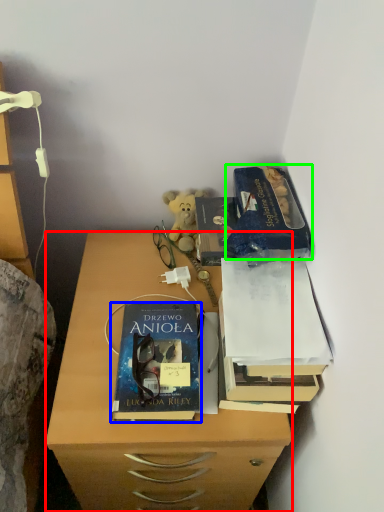
Question: Considering the real-world distances, which object is closest to desk (highlighted by a red box)? book (highlighted by a blue box) or paperback book (highlighted by a green box).

Choices:
 (A) book
 (B) paperback book

Answer: (A)